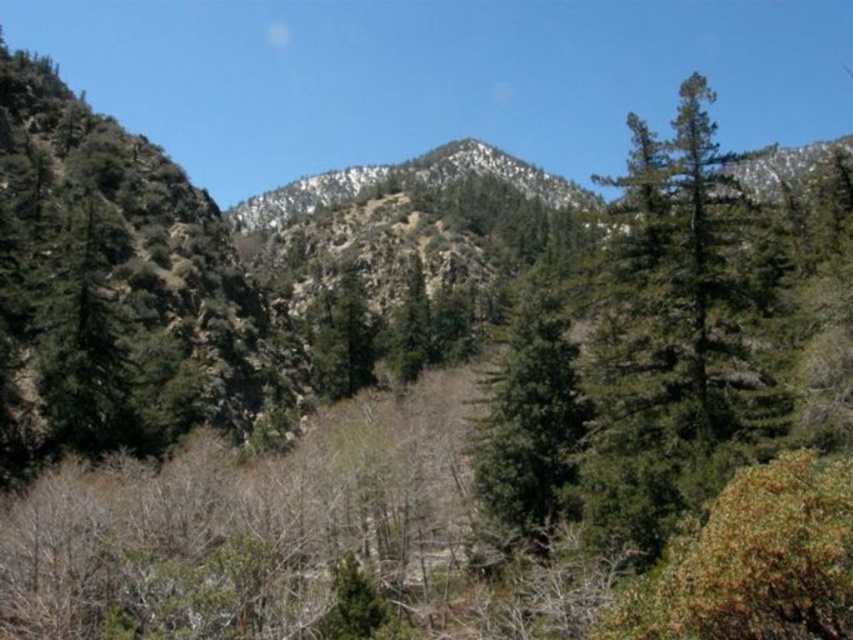
Question: Does green needle-like tree at right have a smaller size compared to green matte tree at center?

Choices:
 (A) no
 (B) yes

Answer: (A)

Question: Does green needle-like tree at right appear over green matte tree at center?

Choices:
 (A) yes
 (B) no

Answer: (A)

Question: Observing the image, what is the correct spatial positioning of green needle-like tree at right in reference to green matte tree at center?

Choices:
 (A) right
 (B) left

Answer: (A)

Question: Which of the following is the closest to the observer?

Choices:
 (A) (572, 371)
 (B) (717, 161)

Answer: (B)

Question: Which object appears farthest from the camera in this image?

Choices:
 (A) green needle-like tree at right
 (B) green matte tree at center

Answer: (B)